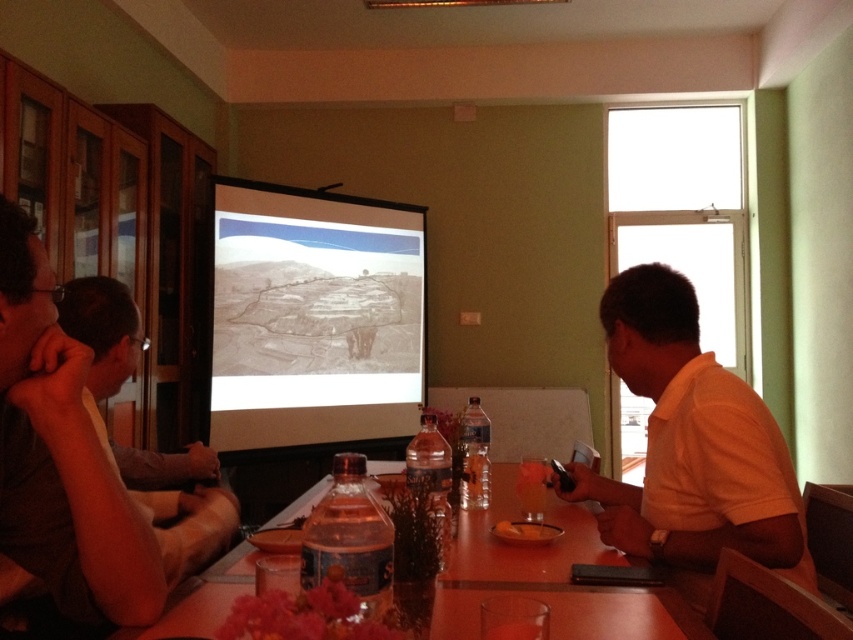
Does matte gray projector screen at center have a larger size compared to dark brown hair at left?

Yes, matte gray projector screen at center is bigger than dark brown hair at left.

Which is in front, point (289, 369) or point (62, 356)?

Point (62, 356) is in front.

Image resolution: width=853 pixels, height=640 pixels. What are the coordinates of `matte gray projector screen at center` in the screenshot? It's located at (x=312, y=316).

How distant is white matte shirt at right from wooden table at center?

11.67 inches

Who is more distant from viewer, (682, 376) or (563, 628)?

Positioned behind is point (682, 376).

The height and width of the screenshot is (640, 853). What are the coordinates of `white matte shirt at right` in the screenshot? It's located at (692, 445).

Who is shorter, matte gray projector screen at center or yellow matte bowl at center?

yellow matte bowl at center

Can you confirm if matte gray projector screen at center is taller than yellow matte bowl at center?

Indeed, matte gray projector screen at center has a greater height compared to yellow matte bowl at center.

Between point (305, 333) and point (544, 538), which one is positioned behind?

Point (305, 333)

Find the location of a particular element. The width and height of the screenshot is (853, 640). matte gray projector screen at center is located at coordinates (312, 316).